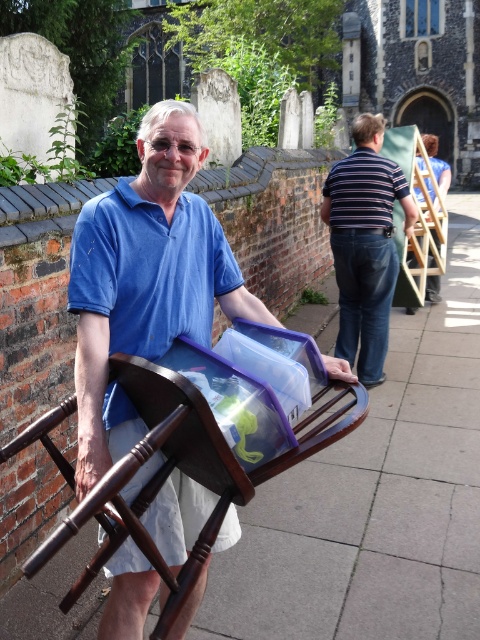
Question: Is matte blue shirt at center closer to the viewer compared to striped cotton shirt at center?

Choices:
 (A) no
 (B) yes

Answer: (B)

Question: Which of the following is the farthest from the observer?

Choices:
 (A) matte blue shirt at center
 (B) striped cotton shirt at center

Answer: (B)

Question: Can you confirm if matte blue shirt at center is smaller than striped cotton shirt at center?

Choices:
 (A) no
 (B) yes

Answer: (A)

Question: Is matte blue shirt at center to the left of striped cotton shirt at center from the viewer's perspective?

Choices:
 (A) no
 (B) yes

Answer: (B)

Question: Among these points, which one is farthest from the camera?

Choices:
 (A) pyautogui.click(x=82, y=280)
 (B) pyautogui.click(x=354, y=122)

Answer: (B)

Question: Which of the following is the closest to the observer?

Choices:
 (A) matte blue shirt at center
 (B) striped cotton shirt at center

Answer: (A)